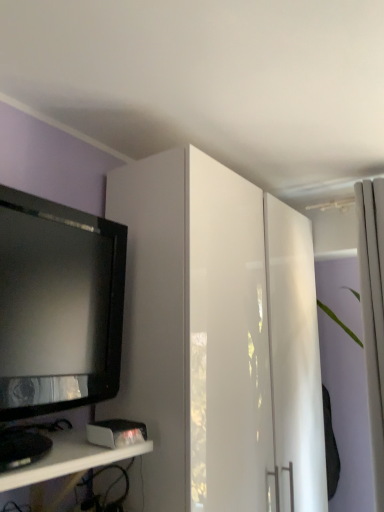
Question: From the image's perspective, does white glossy cabinet at upper center appear lower than black glossy television at left?

Choices:
 (A) no
 (B) yes

Answer: (B)

Question: From the image's perspective, is white glossy cabinet at upper center over black glossy television at left?

Choices:
 (A) yes
 (B) no

Answer: (B)

Question: Can you confirm if white glossy cabinet at upper center is taller than black glossy television at left?

Choices:
 (A) no
 (B) yes

Answer: (B)

Question: Does white glossy cabinet at upper center turn towards black glossy television at left?

Choices:
 (A) no
 (B) yes

Answer: (A)

Question: Does white glossy cabinet at upper center have a larger size compared to black glossy television at left?

Choices:
 (A) no
 (B) yes

Answer: (B)

Question: Considering the relative sizes of white glossy cabinet at upper center and black glossy television at left in the image provided, is white glossy cabinet at upper center shorter than black glossy television at left?

Choices:
 (A) no
 (B) yes

Answer: (A)

Question: Is black glossy television at left to the left of white glossy shelf at lower left from the viewer's perspective?

Choices:
 (A) yes
 (B) no

Answer: (B)

Question: Does black glossy television at left come behind white glossy shelf at lower left?

Choices:
 (A) no
 (B) yes

Answer: (B)

Question: Considering the relative sizes of black glossy television at left and white glossy shelf at lower left in the image provided, is black glossy television at left thinner than white glossy shelf at lower left?

Choices:
 (A) no
 (B) yes

Answer: (B)

Question: Is black glossy television at left facing away from white glossy shelf at lower left?

Choices:
 (A) no
 (B) yes

Answer: (A)

Question: Is black glossy television at left oriented towards white glossy shelf at lower left?

Choices:
 (A) yes
 (B) no

Answer: (B)

Question: Would you say black glossy television at left contains white glossy shelf at lower left?

Choices:
 (A) no
 (B) yes

Answer: (A)

Question: Is white glossy cabinet at upper center behind white fabric curtain at right?

Choices:
 (A) no
 (B) yes

Answer: (A)